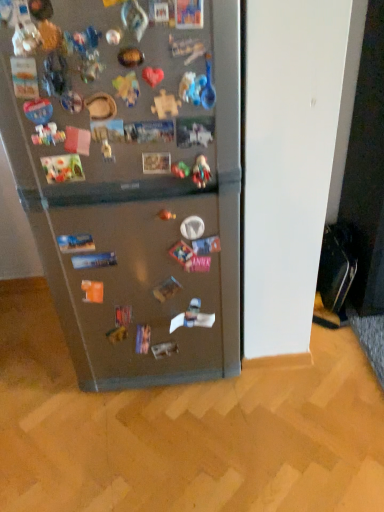
This screenshot has width=384, height=512. Find the location of `free space in front of satin metallic refrigerator at center`. free space in front of satin metallic refrigerator at center is located at coordinates (124, 453).